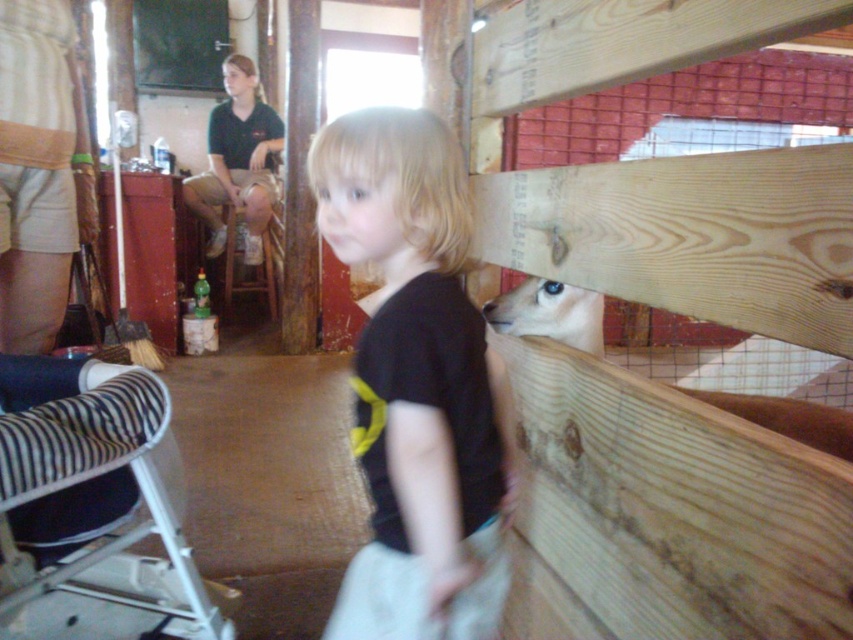
Looking at this image, you are a photographer setting up a shoot in this barn. You need to position a light source so that it illuminates both the black matte shirt at center and the blue glossy antelope at upper right without casting harsh shadows. Considering their heights, which object should be placed closer to the light source to ensure even illumination?

The blue glossy antelope at upper right should be placed closer to the light source because the black matte shirt at center has a greater height, meaning the antelope requires more direct light to achieve even illumination.

You are standing at the entrance of the barn and see two points marked in the image. Which point is closer to you, point (x=363, y=380) or point (x=512, y=326)?

Point (x=363, y=380) is in front of point (x=512, y=326), so it is closer to you.

You are a photographer setting up a shoot in this barn. You need to position a light source between the black matte shirt at center and the blue glossy antelope at upper right. Based on their positions, which object should the light be closer to?

The light source should be closer to the blue glossy antelope at upper right because the black matte shirt at center is positioned to its left, meaning the antelope is further to the right where the light can better illuminate it.